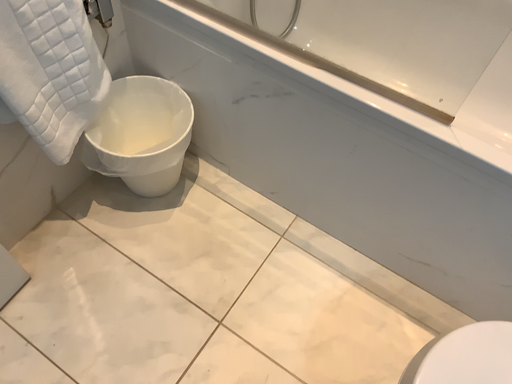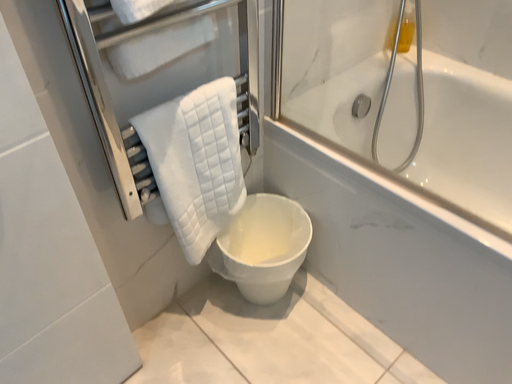
Question: How did the camera likely rotate when shooting the video?

Choices:
 (A) rotated downward
 (B) rotated upward

Answer: (B)